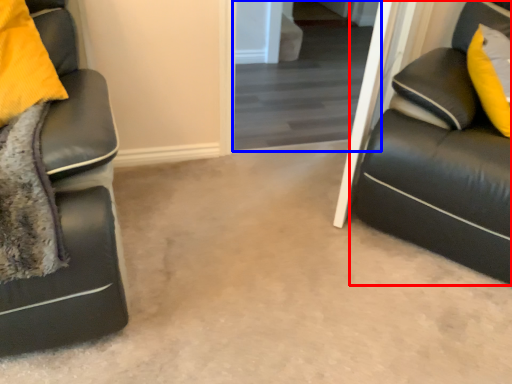
Question: Among these objects, which one is nearest to the camera, studio couch (highlighted by a red box) or glass door (highlighted by a blue box)?

Choices:
 (A) studio couch
 (B) glass door

Answer: (A)